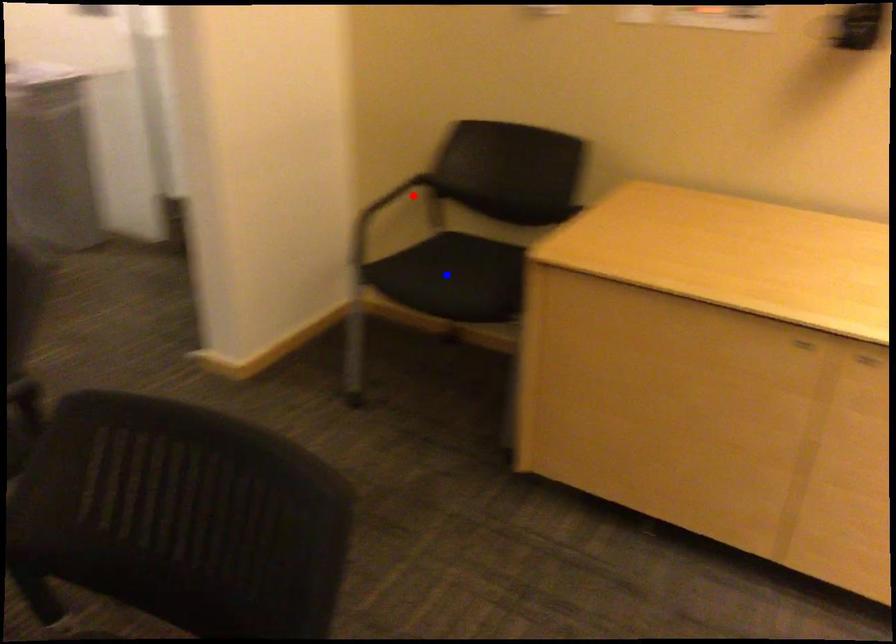
Question: Two points are marked on the image. Which point is closer to the camera?

Choices:
 (A) Blue point is closer.
 (B) Red point is closer.

Answer: (A)